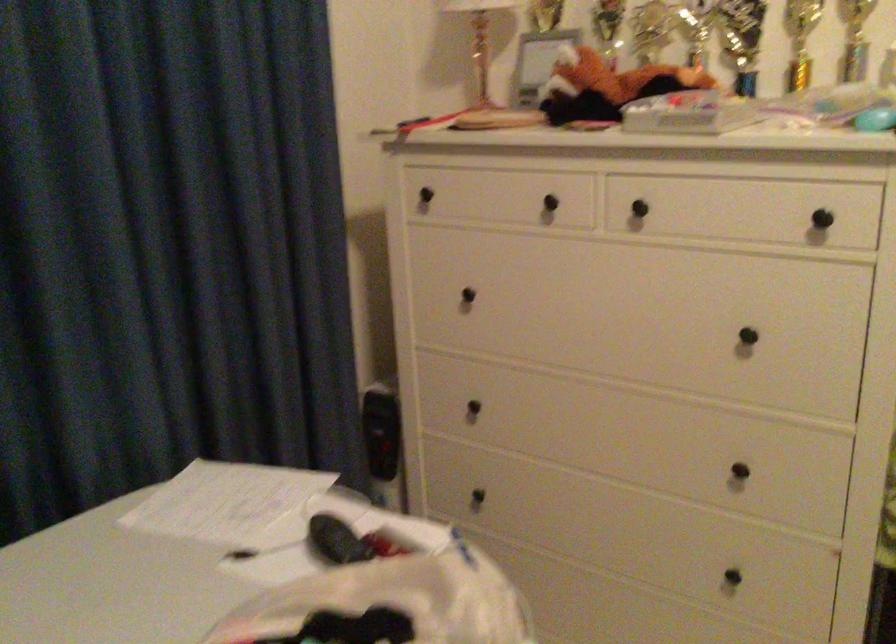
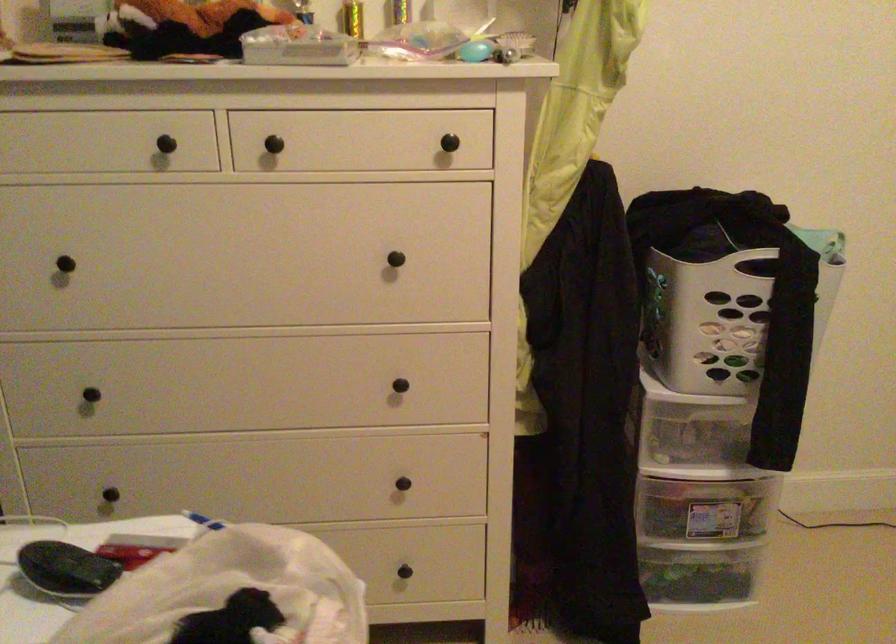
Question: The camera is either moving clockwise (left) or counter-clockwise (right) around the object. The first image is from the beginning of the video and the second image is from the end. Is the camera moving left or right when shooting the video?

Choices:
 (A) Left
 (B) Right

Answer: (A)